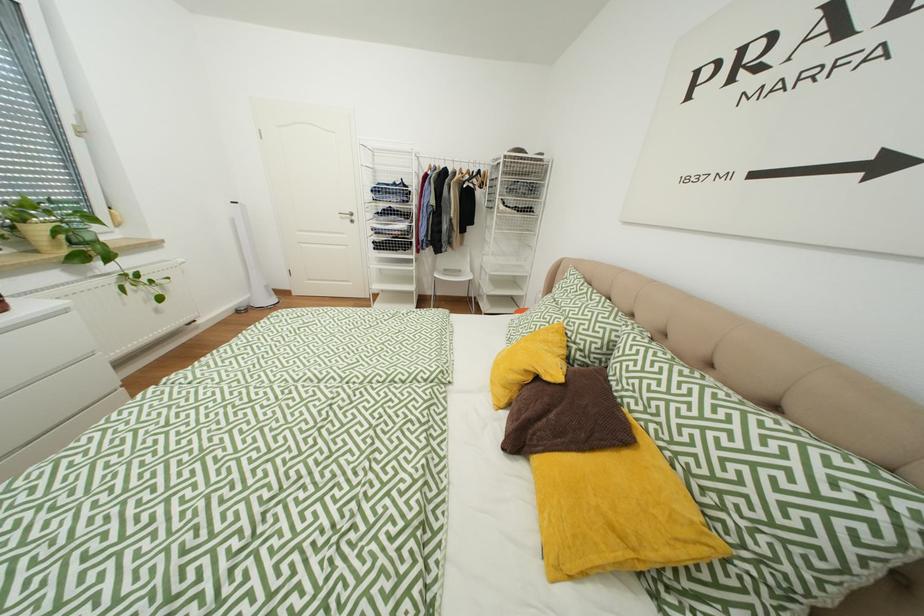
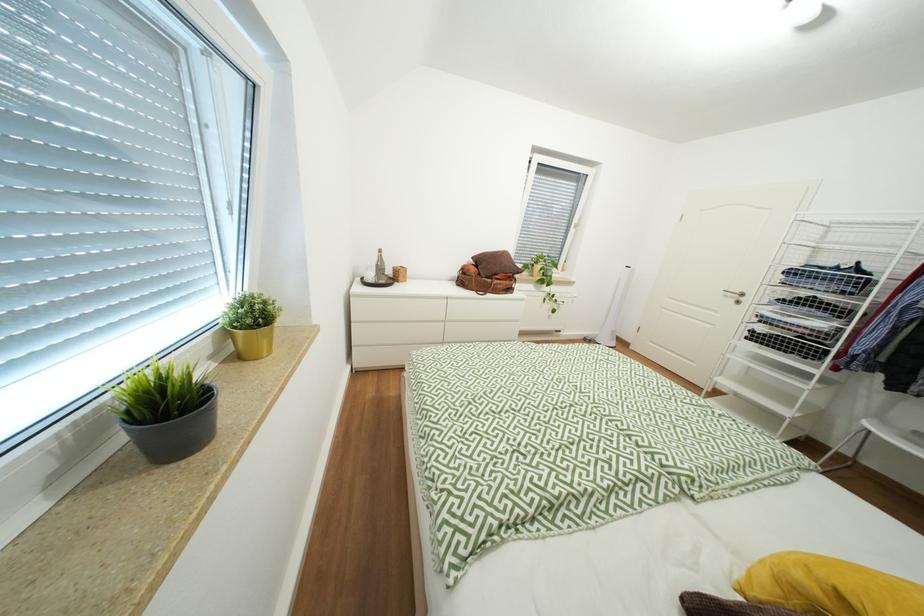
Question: The images are taken continuously from a first-person perspective. In which direction is your viewpoint rotating?

Choices:
 (A) Left
 (B) Right
 (C) Up
 (D) Down

Answer: (A)